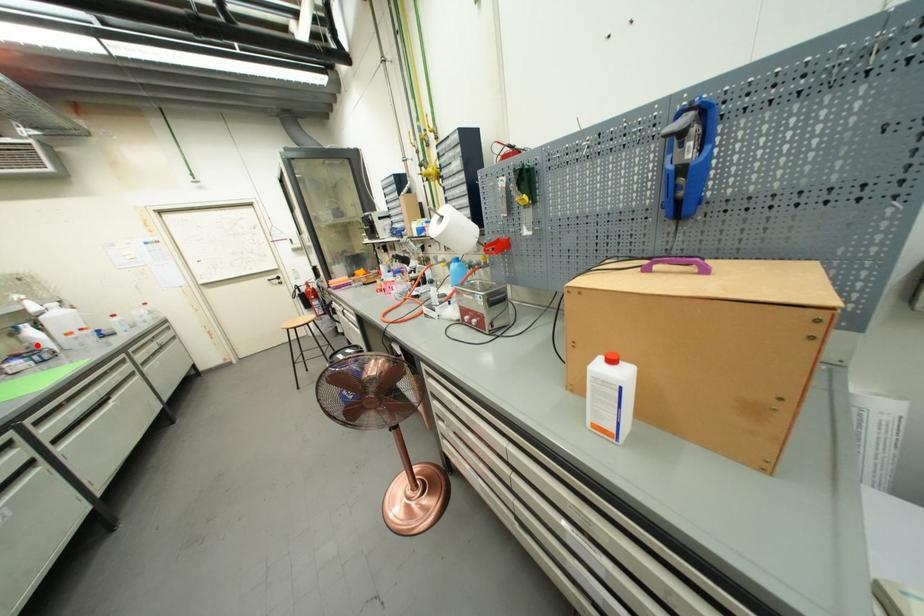
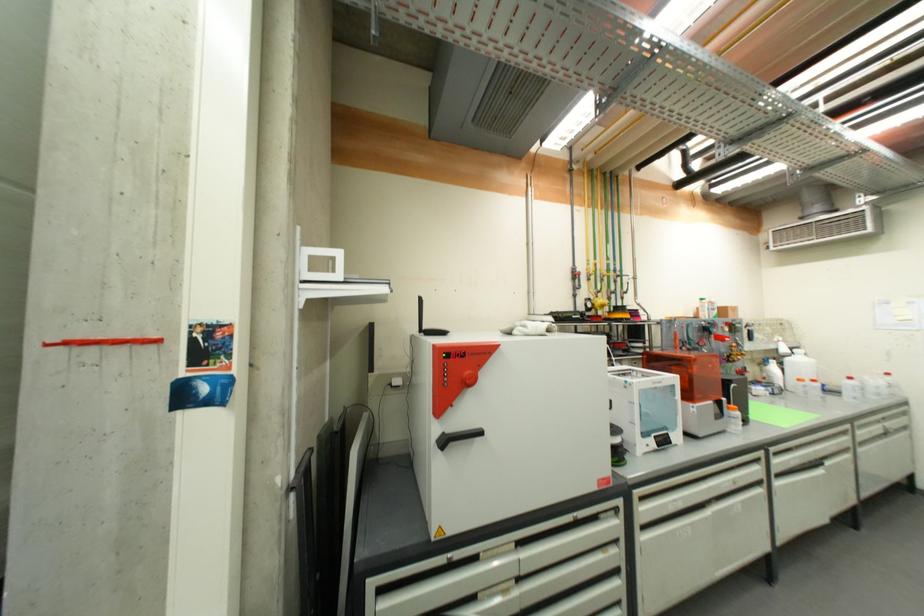
Question: I am providing you with two images of the same scene from different viewpoints. A red point is shown in image1. For the corresponding object point in image2, is it positioned nearer or farther from the camera?

Choices:
 (A) Nearer
 (B) Farther

Answer: (A)